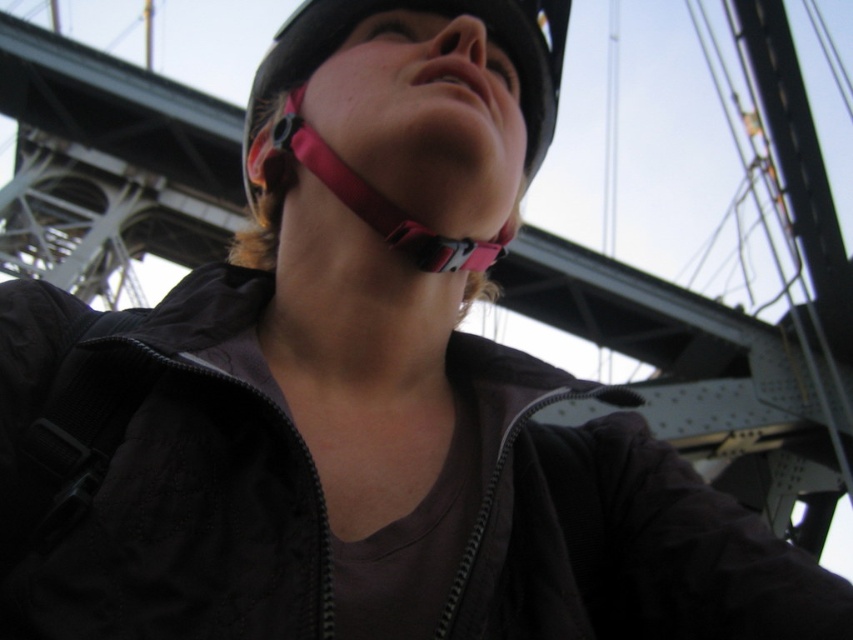
Does black matte helmet at upper center have a greater height compared to pink fabric strap at center?

Yes, black matte helmet at upper center is taller than pink fabric strap at center.

Between point (543, 97) and point (396, 248), which one is positioned behind?

Point (543, 97)

In order to click on black matte helmet at upper center in this screenshot , I will do `click(431, 12)`.